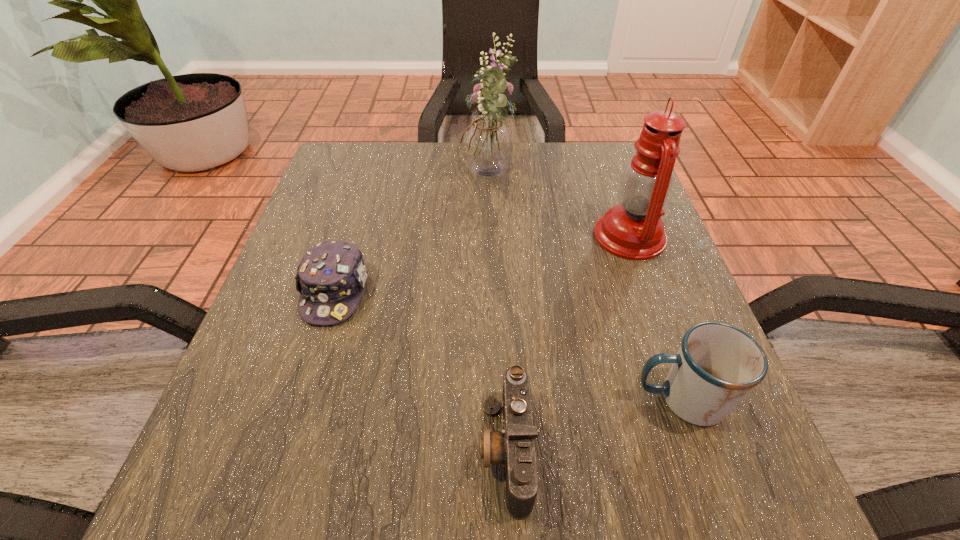
This screenshot has height=540, width=960. I want to click on vacant point located 0.220m on the handle side of the third shortest object, so click(x=483, y=399).

You are a GUI agent. You are given a task and a screenshot of the screen. Output one action in this format:
    pyautogui.click(x=<x>, y=<y>)
    Task: Click on the free space located 0.100m on the handle side of the third shortest object
    The image size is (960, 540).
    Given the screenshot: What is the action you would take?
    pyautogui.click(x=564, y=399)

Locate an element on the screen. This screenshot has width=960, height=540. free region located on the front-facing side of the camera is located at coordinates (332, 450).

This screenshot has height=540, width=960. What are the coordinates of `vacant space located on the front-facing side of the camera` in the screenshot? It's located at (444, 450).

This screenshot has height=540, width=960. In order to click on vacant space located on the front-facing side of the camera in this screenshot , I will do `click(205, 450)`.

I want to click on free space located on the front-facing side of the leftmost object, so click(x=265, y=518).

Where is `object that is at the far edge`? The image size is (960, 540). object that is at the far edge is located at coordinates (487, 143).

Where is `object present at the near edge`? object present at the near edge is located at coordinates (514, 447).

Locate an element on the screen. The width and height of the screenshot is (960, 540). object that is at the left edge is located at coordinates (330, 278).

Find the location of a particular element. The image size is (960, 540). oil lamp present at the right edge is located at coordinates (634, 230).